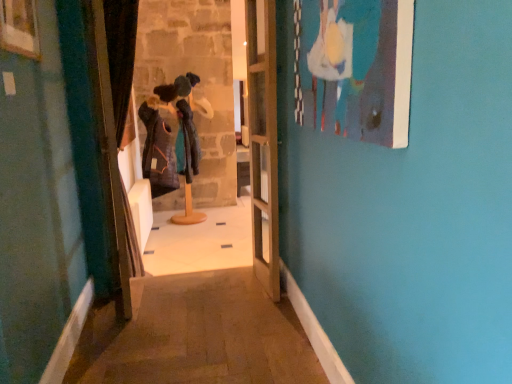
Question: Is wooden picture frame at upper left, which is the 2th picture frame in right-to-left order, not within velvet dark brown curtain at left?

Choices:
 (A) yes
 (B) no

Answer: (A)

Question: Is wooden picture frame at upper left, which is the 2th picture frame in right-to-left order, behind velvet dark brown curtain at left?

Choices:
 (A) no
 (B) yes

Answer: (A)

Question: Can you confirm if wooden picture frame at upper left, acting as the 1th picture frame starting from the left, is shorter than velvet dark brown curtain at left?

Choices:
 (A) no
 (B) yes

Answer: (B)

Question: Is wooden picture frame at upper left, which is the 2th picture frame in right-to-left order, thinner than velvet dark brown curtain at left?

Choices:
 (A) yes
 (B) no

Answer: (A)

Question: Considering the relative sizes of wooden picture frame at upper left, acting as the 1th picture frame starting from the left, and velvet dark brown curtain at left in the image provided, is wooden picture frame at upper left, acting as the 1th picture frame starting from the left, taller than velvet dark brown curtain at left?

Choices:
 (A) yes
 (B) no

Answer: (B)

Question: Would you say knitted woolen hat at center is to the left or to the right of clear glass door at center in the picture?

Choices:
 (A) right
 (B) left

Answer: (B)

Question: Which is correct: knitted woolen hat at center is inside clear glass door at center, or outside of it?

Choices:
 (A) outside
 (B) inside

Answer: (A)

Question: Does point (183, 115) appear closer or farther from the camera than point (260, 235)?

Choices:
 (A) farther
 (B) closer

Answer: (A)

Question: From the image's perspective, is knitted woolen hat at center above or below clear glass door at center?

Choices:
 (A) below
 (B) above

Answer: (B)

Question: Does point (1, 6) appear closer or farther from the camera than point (189, 150)?

Choices:
 (A) closer
 (B) farther

Answer: (A)

Question: Considering the positions of wooden picture frame at upper left, which is the 2th picture frame in right-to-left order, and knitted woolen hat at center in the image, is wooden picture frame at upper left, which is the 2th picture frame in right-to-left order, wider or thinner than knitted woolen hat at center?

Choices:
 (A) wide
 (B) thin

Answer: (B)

Question: From the image's perspective, is wooden picture frame at upper left, acting as the 1th picture frame starting from the left, positioned above or below knitted woolen hat at center?

Choices:
 (A) above
 (B) below

Answer: (A)

Question: Is wooden picture frame at upper left, which is the 2th picture frame in right-to-left order, situated inside knitted woolen hat at center or outside?

Choices:
 (A) inside
 (B) outside

Answer: (B)

Question: In the image, is matte blue painting at upper right, which appears as the second picture frame when viewed from the left, on the left side or the right side of clear glass door at center?

Choices:
 (A) left
 (B) right

Answer: (B)

Question: In the image, is matte blue painting at upper right, which appears as the second picture frame when viewed from the left, positioned in front of or behind clear glass door at center?

Choices:
 (A) behind
 (B) front

Answer: (B)